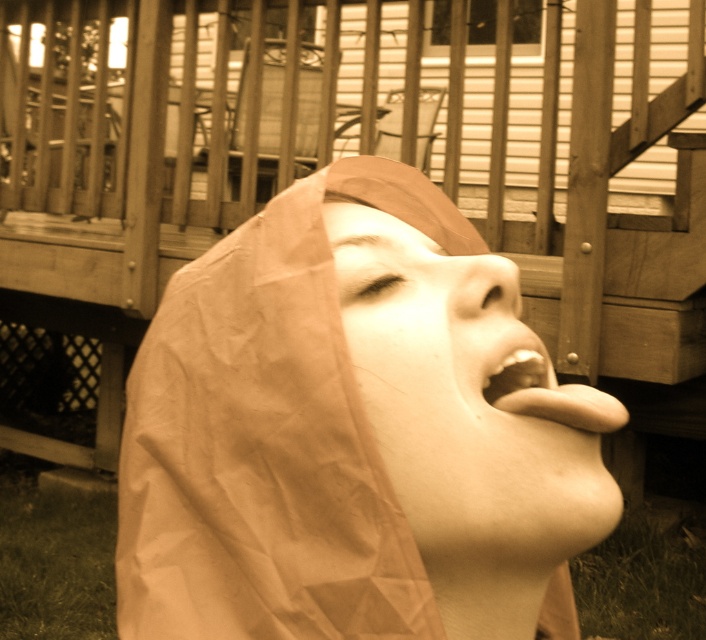
Measure the distance between point (366, 381) and camera.

Point (366, 381) is 21.38 inches from camera.

Looking at this image, can you confirm if matte paper mask at center is positioned to the left of shiny metallic teeth at lower right?

Indeed, matte paper mask at center is positioned on the left side of shiny metallic teeth at lower right.

Is point (573, 456) closer to camera compared to point (561, 408)?

No.

Locate an element on the screen. matte paper mask at center is located at coordinates (467, 403).

Is shiny metallic teeth at lower right to the right of matte brown paper at lower center from the viewer's perspective?

Yes, shiny metallic teeth at lower right is to the right of matte brown paper at lower center.

What do you see at coordinates (550, 394) in the screenshot? I see `shiny metallic teeth at lower right` at bounding box center [550, 394].

Is point (546, 385) closer to viewer compared to point (539, 358)?

No, it is behind (539, 358).

This screenshot has width=706, height=640. In order to click on shiny metallic teeth at lower right in this screenshot , I will do `click(550, 394)`.

Does brown paper bag at center have a smaller size compared to matte paper mask at center?

No, brown paper bag at center is not smaller than matte paper mask at center.

Which of these two, brown paper bag at center or matte paper mask at center, stands taller?

brown paper bag at center is taller.

What do you see at coordinates (352, 433) in the screenshot? The height and width of the screenshot is (640, 706). I see `brown paper bag at center` at bounding box center [352, 433].

In order to click on brown paper bag at center in this screenshot , I will do `click(352, 433)`.